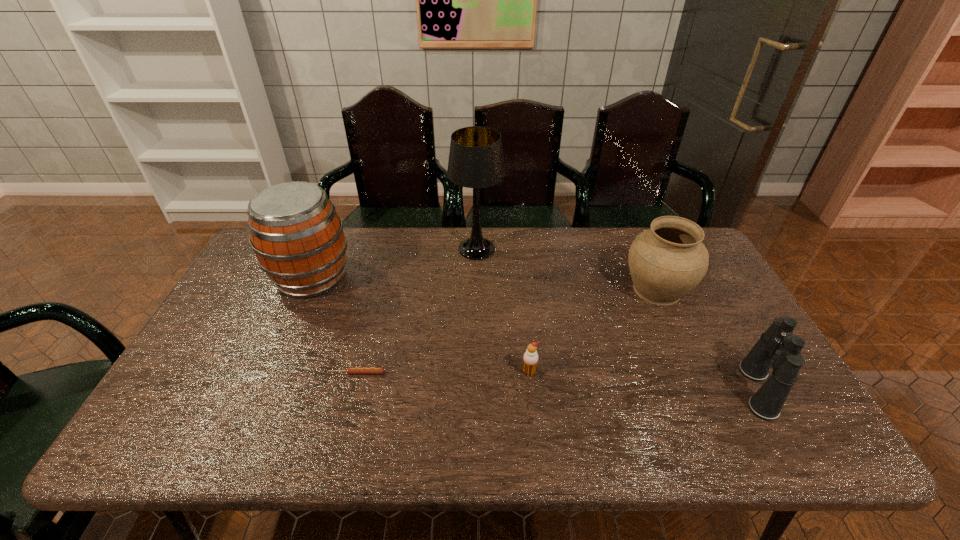
Locate an element on the screen. Image resolution: width=960 pixels, height=540 pixels. the tallest object is located at coordinates (476, 161).

Image resolution: width=960 pixels, height=540 pixels. In order to click on table lamp in this screenshot , I will do `click(476, 161)`.

Identify the location of the fifth shortest object. (297, 236).

Find the location of `cider`. cider is located at coordinates (297, 236).

The width and height of the screenshot is (960, 540). What are the coordinates of `urn` in the screenshot? It's located at (667, 261).

Locate an element on the screen. The height and width of the screenshot is (540, 960). binoculars is located at coordinates (777, 348).

I want to click on the fourth object from left to right, so click(530, 357).

The height and width of the screenshot is (540, 960). What are the coordinates of `icecream` in the screenshot? It's located at (530, 357).

Locate an element on the screen. The height and width of the screenshot is (540, 960). the fifth object from right to left is located at coordinates (351, 370).

Where is `sausage`? sausage is located at coordinates (351, 370).